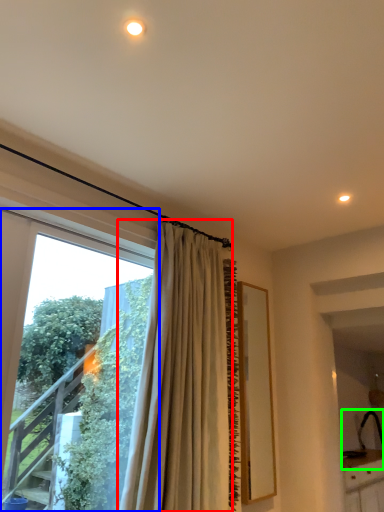
Question: Which object is the farthest from curtain (highlighted by a red box)? Choose among these: window (highlighted by a blue box) or sink (highlighted by a green box).

Choices:
 (A) window
 (B) sink

Answer: (B)